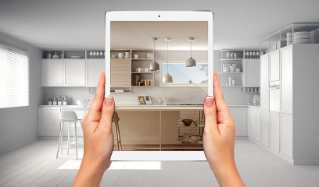
Locate an element on the screen. The width and height of the screenshot is (319, 187). white ceiling is located at coordinates (183, 34).